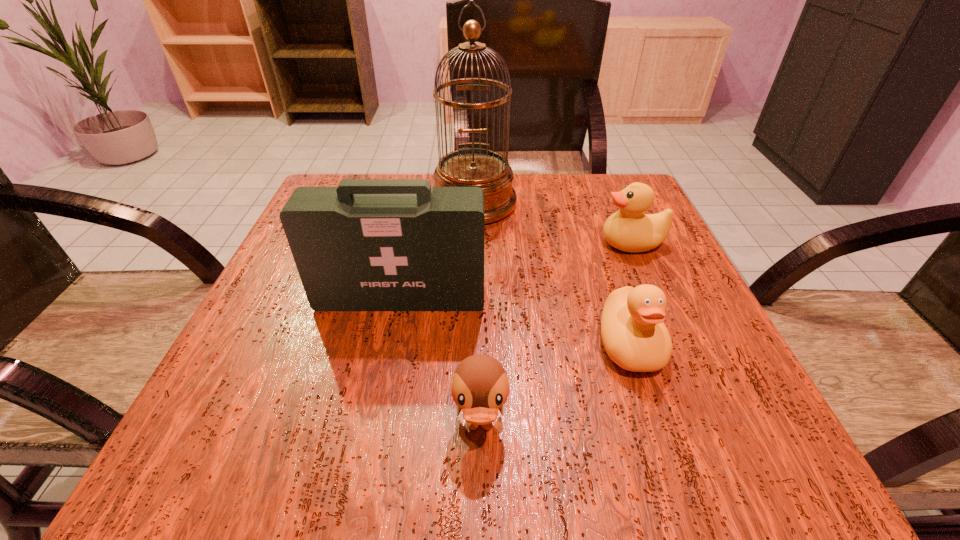
Locate an element on the screen. The height and width of the screenshot is (540, 960). free spot between the leftmost duck and the tallest object is located at coordinates (477, 314).

At what (x,y) coordinates should I click in order to perform the action: click on the third closest object relative to the farthest duck. Please return your answer as a coordinate pair (x, y). This screenshot has height=540, width=960. Looking at the image, I should click on (369, 244).

Choose which object is the nearest neighbor to the second farthest object. Please provide its 2D coordinates. Your answer should be formatted as a tuple, i.e. [(x, y)], where the tuple contains the x and y coordinates of a point satisfying the conditions above.

[(633, 333)]

You are a GUI agent. You are given a task and a screenshot of the screen. Output one action in this format:
    pyautogui.click(x=<x>, y=<y>)
    Task: Click on the duck that can be found as the closest to the second farthest object
    The image size is (960, 540).
    Given the screenshot: What is the action you would take?
    pyautogui.click(x=633, y=333)

Image resolution: width=960 pixels, height=540 pixels. I want to click on the second closest duck to the first-aid kit, so click(x=633, y=333).

At what (x,y) coordinates should I click in order to perform the action: click on vacant area that satisfies the following two spatial constraints: 1. at the beak of the farthest duck; 2. on the front-facing side of the nearest duck. Please return your answer as a coordinate pair (x, y). This screenshot has height=540, width=960. Looking at the image, I should click on tap(711, 426).

Image resolution: width=960 pixels, height=540 pixels. Identify the location of free space in the image that satisfies the following two spatial constraints: 1. at the beak of the farthest duck; 2. on the face of the second nearest object. (676, 344).

The image size is (960, 540). Find the location of `free location that satisfies the following two spatial constraints: 1. at the beak of the farthest duck; 2. on the front-facing side of the nearest object`. free location that satisfies the following two spatial constraints: 1. at the beak of the farthest duck; 2. on the front-facing side of the nearest object is located at coordinates (711, 426).